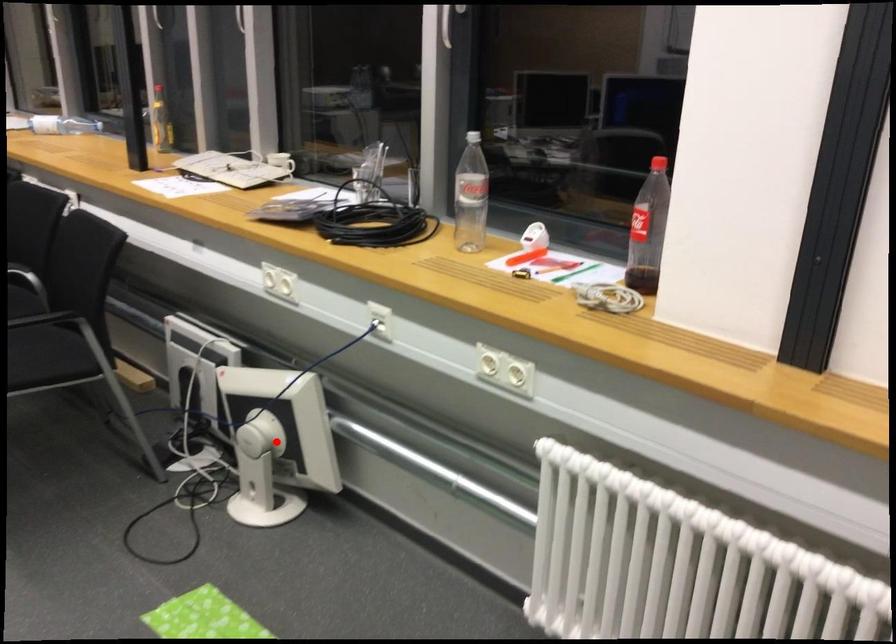
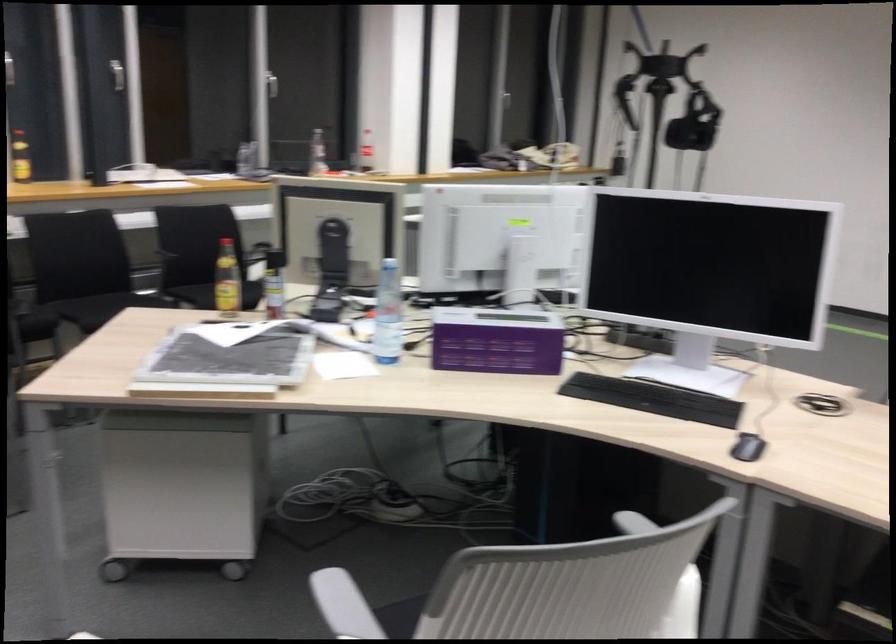
Question: I am providing you with two images of the same scene from different viewpoints. A red point is marked on the first image. Can you still see the location of the red point in image 2?

Choices:
 (A) Yes
 (B) No

Answer: (B)